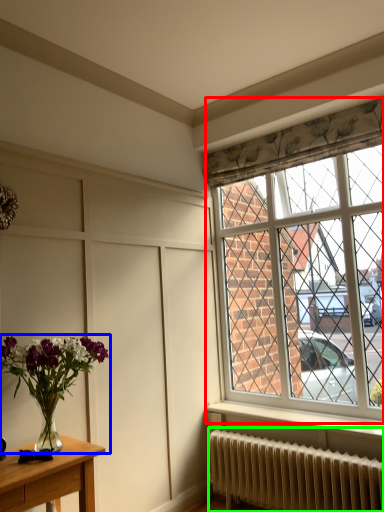
Question: Which object is positioned farthest from window (highlighted by a red box)? Select from houseplant (highlighted by a blue box) and radiator (highlighted by a green box).

Choices:
 (A) houseplant
 (B) radiator

Answer: (A)